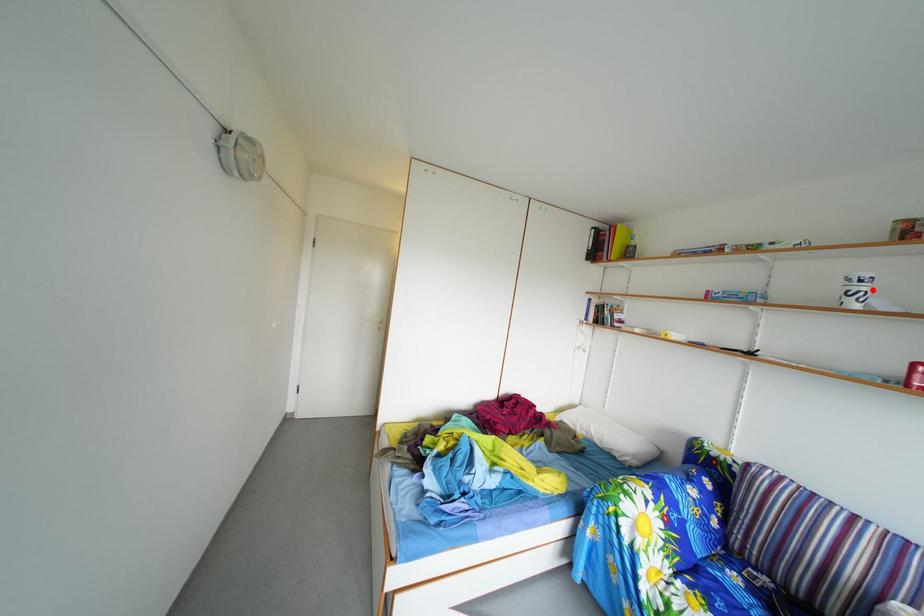
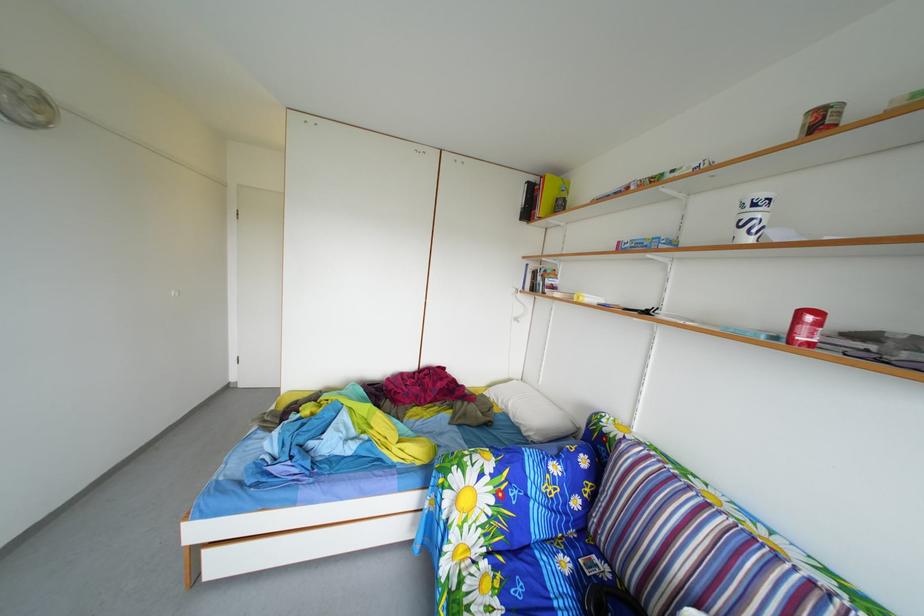
In the second image, find the point that corresponds to the highlighted location in the first image.

(766, 214)